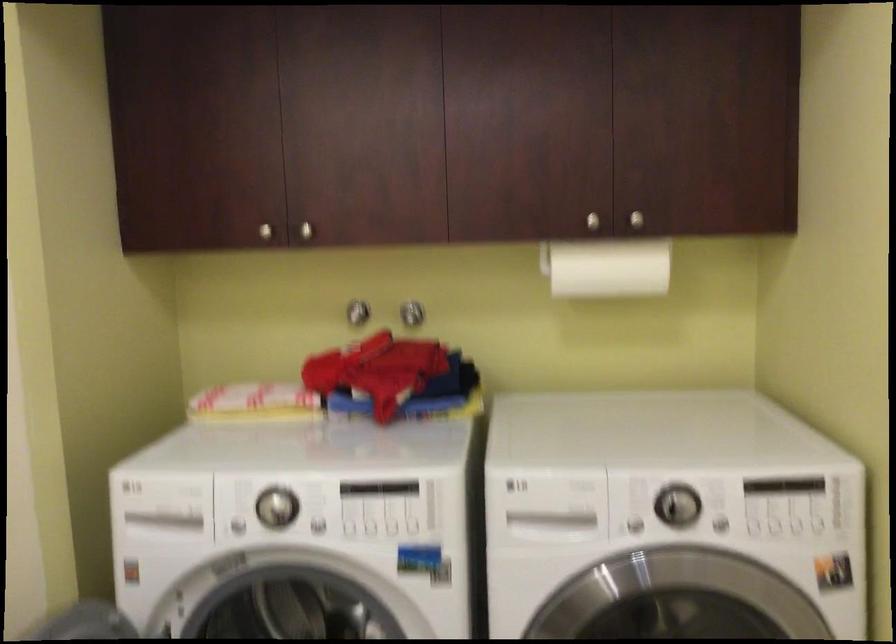
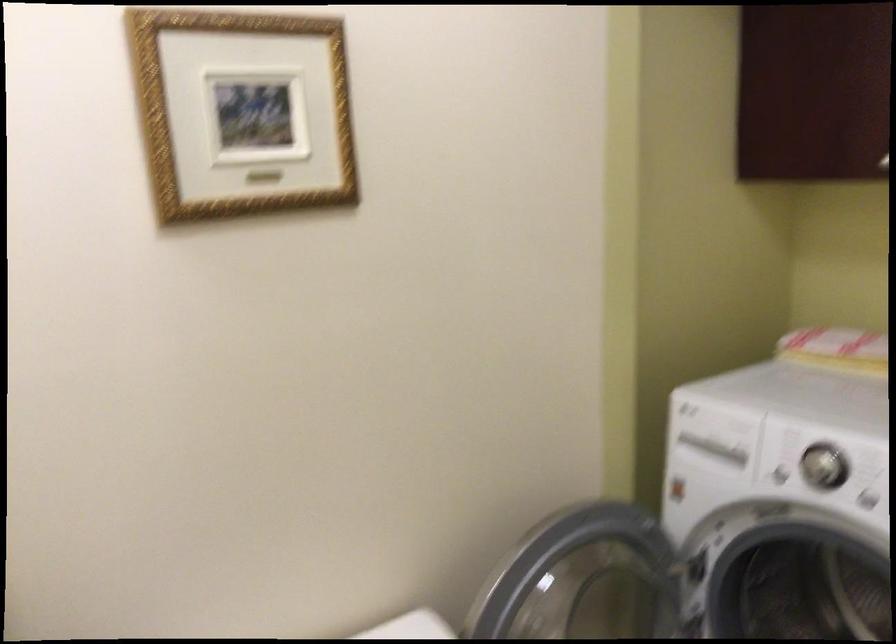
The point at (158, 526) is marked in the first image. Where is the corresponding point in the second image?

(708, 451)